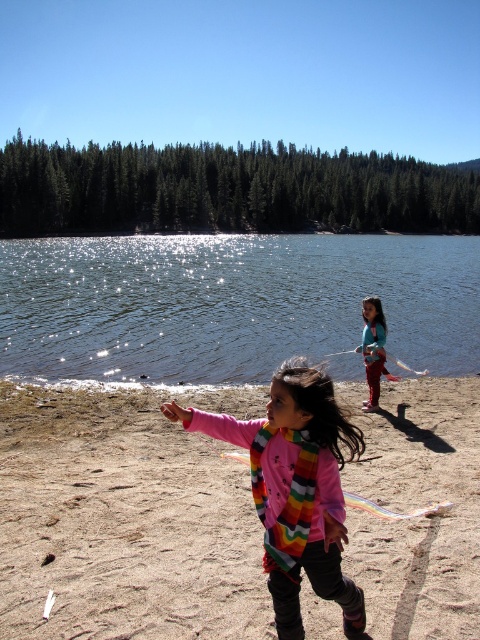
You are a photographer standing on the beach and want to take a photo that includes both the smooth beige sand at lower center and the multicolored scarf at right. Based on their positions, which object should appear lower in the photo?

The smooth beige sand at lower center should appear lower in the photo because it is positioned below the multicolored scarf at right.

You are a photographer trying to capture both the rainbow striped scarf at center and the multicolored scarf at right in a single shot. Based on their positions, which scarf should you focus on first to ensure both are in frame?

You should focus on the rainbow striped scarf at center first because it is to the left of the multicolored scarf at right, so by centering the rainbow striped scarf at center, the multicolored scarf at right will naturally fall into the frame as well.

You are a photographer trying to capture the rainbow striped scarf at center in your shot. The camera has a focus point at coordinates 0.764, 0.617. Is the scarf positioned exactly at the focus point?

Yes, the rainbow striped scarf at center is positioned exactly at the coordinates (296, 488), so it will be in focus.